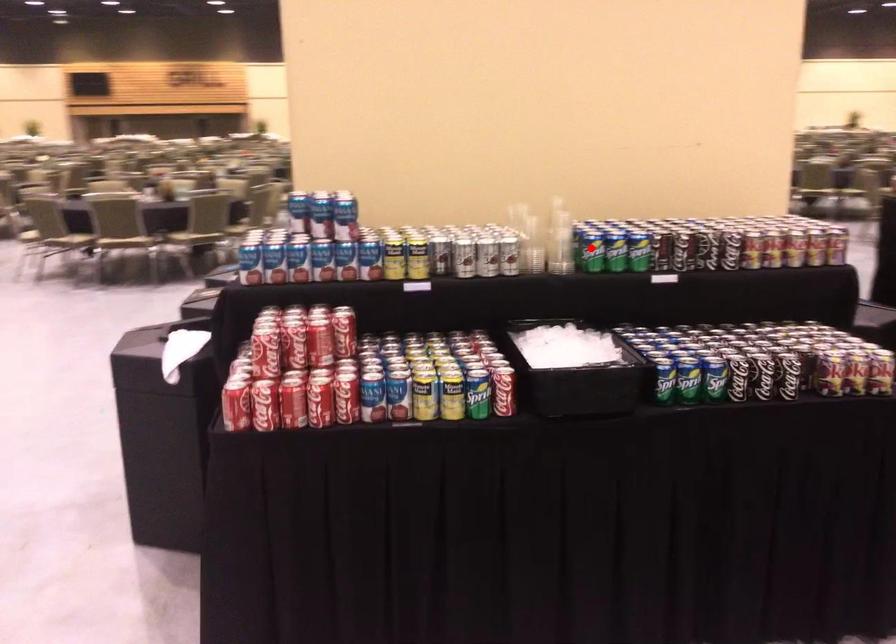
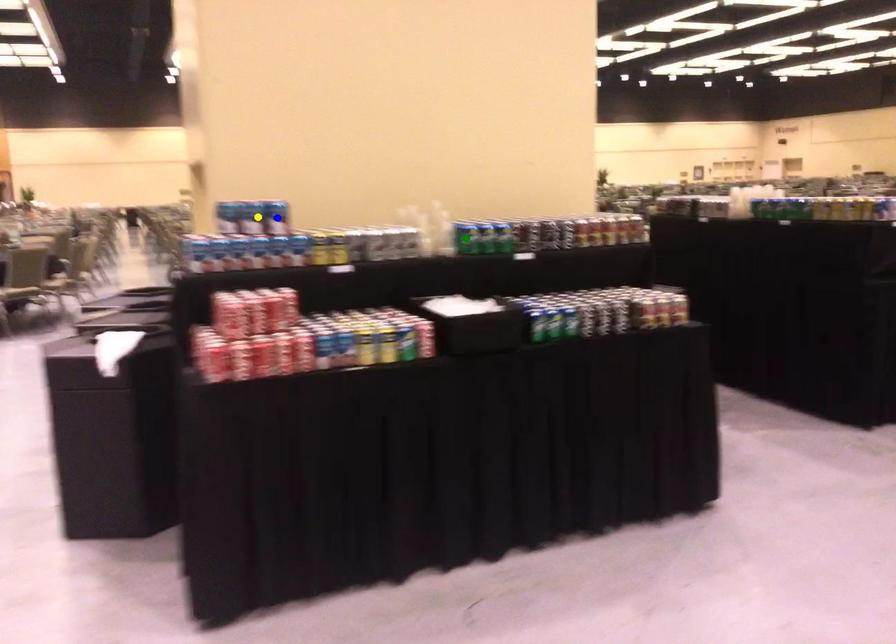
Question: I am providing you with two images of the same scene from different viewpoints. A red point is marked on the first image. You are given multiple points on the second image. In image 2, which mark is for the same physical point as the one in image 1?

Choices:
 (A) green point
 (B) yellow point
 (C) blue point

Answer: (A)